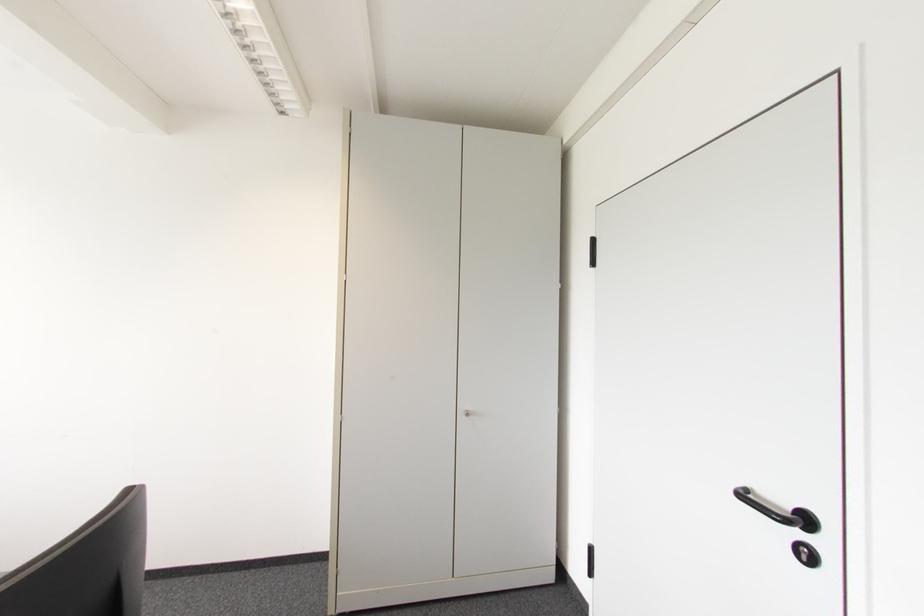
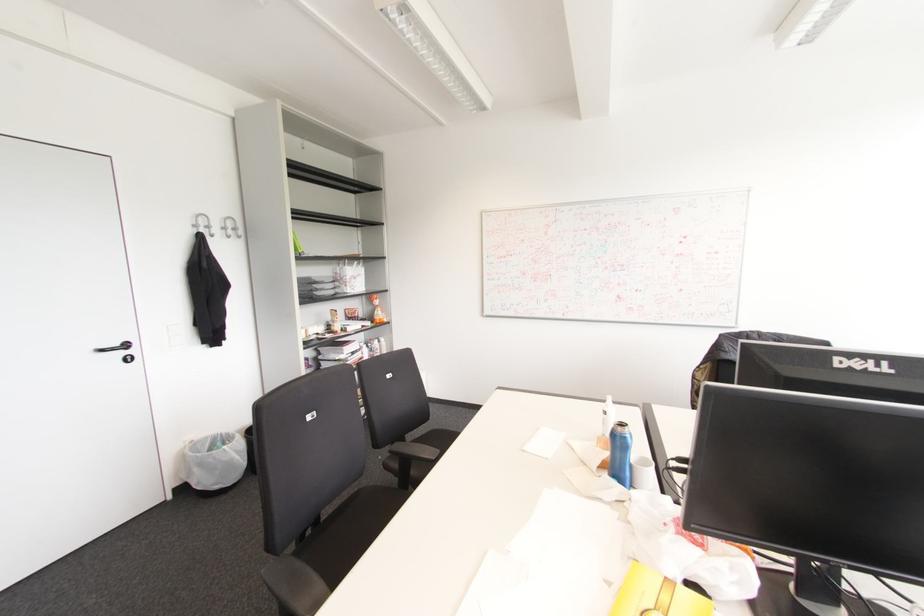
In the second image, find the point that corresponds to point (805, 521) in the first image.

(126, 345)